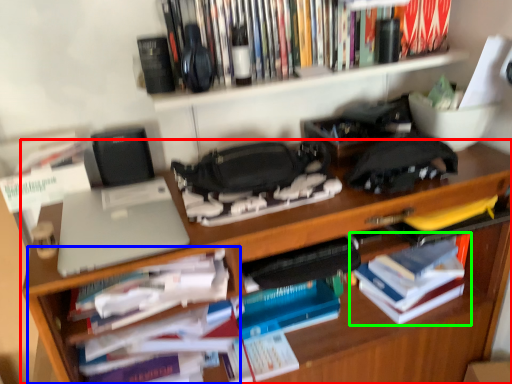
Question: Which is nearer to the desk (highlighted by a red box)? cabinet (highlighted by a blue box) or book (highlighted by a green box).

Choices:
 (A) cabinet
 (B) book

Answer: (B)